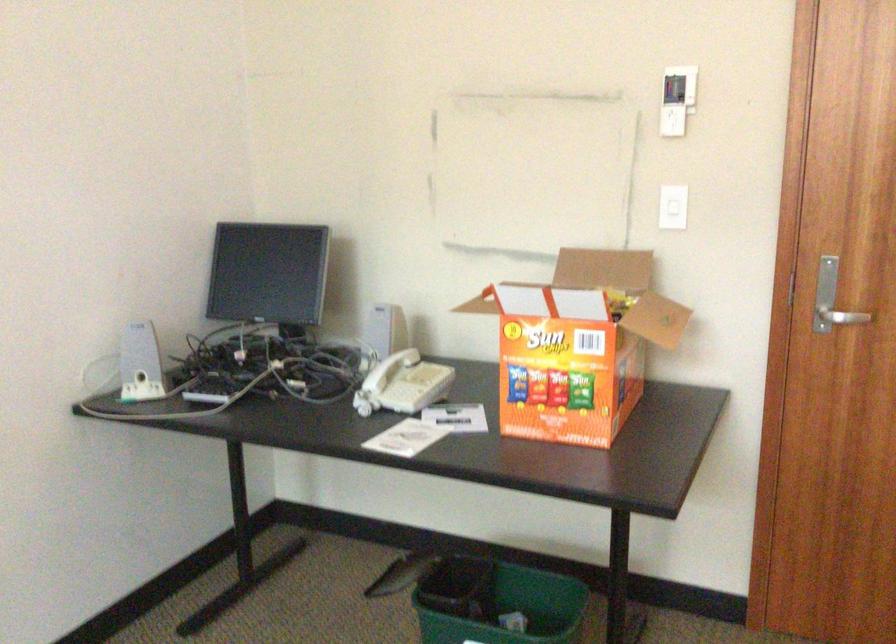
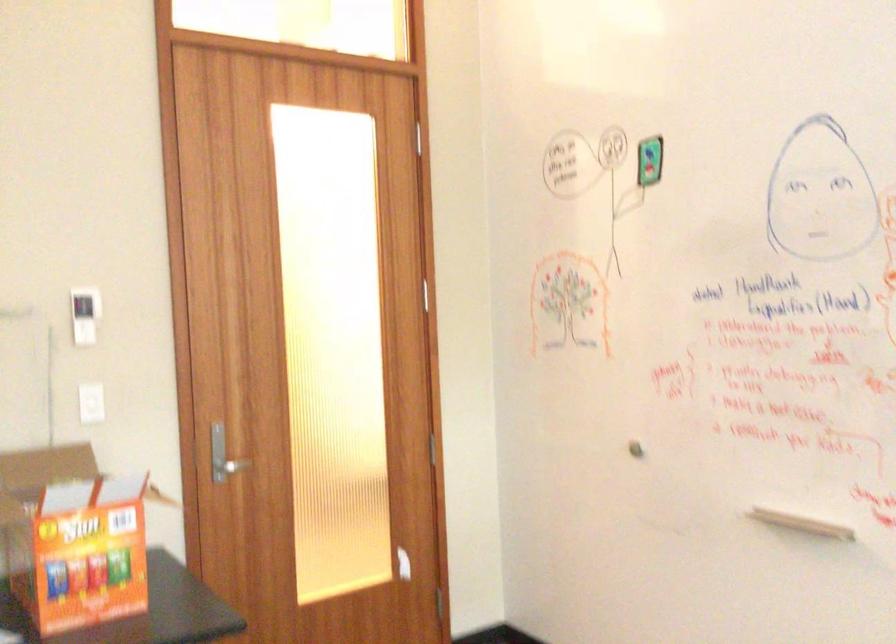
Where in the second image is the point corresponding to the point at 537,352 from the first image?

(72, 538)